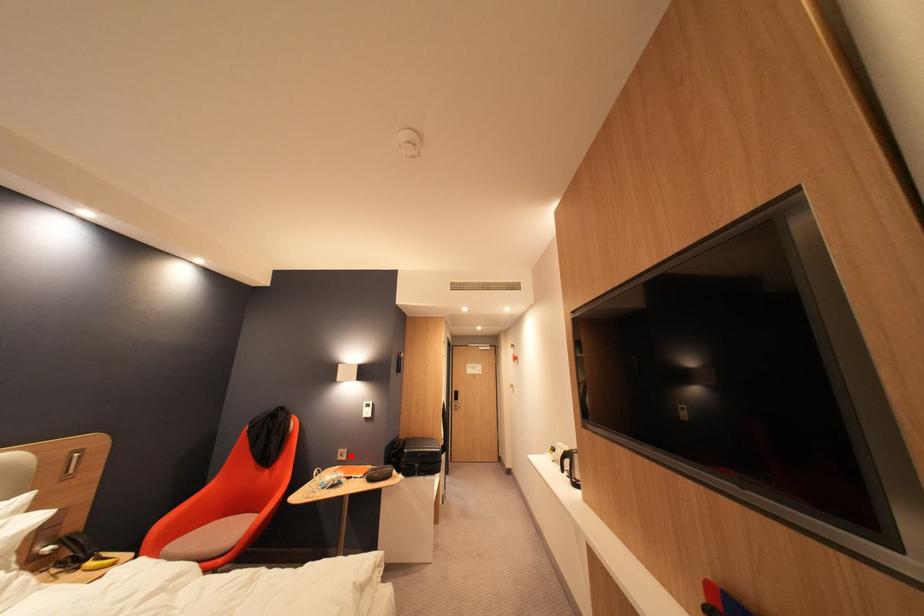
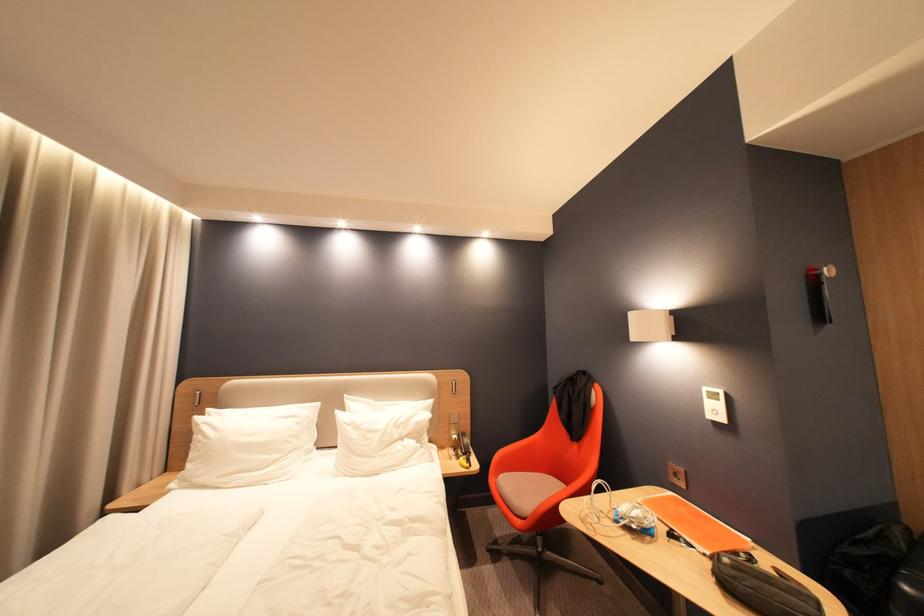
In the second image, find the point that corresponds to the highlighted location in the first image.

(686, 476)